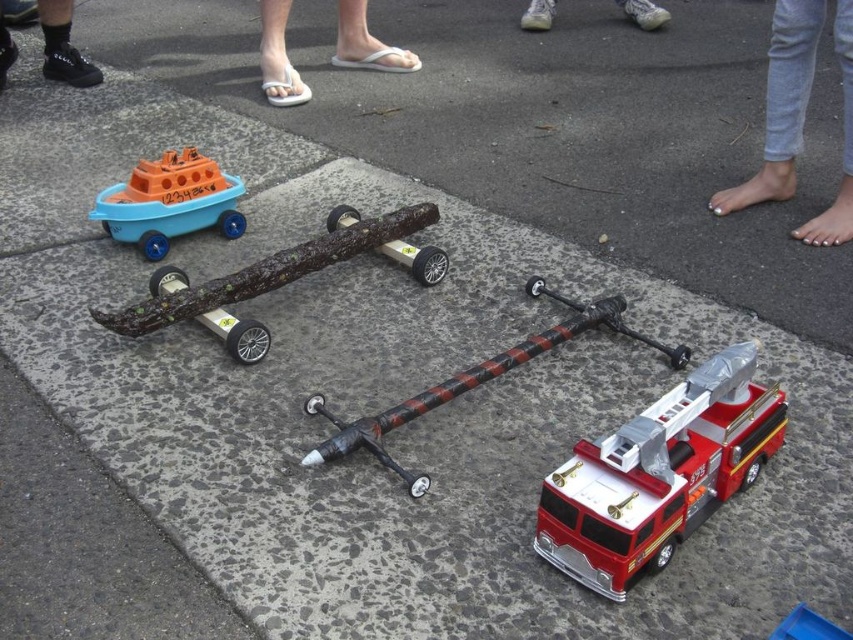
Question: Is matte blue plastic boat at upper left smaller than plastic/toy sword at center?

Choices:
 (A) yes
 (B) no

Answer: (A)

Question: Which is nearer to the gray denim jeans at upper right?

Choices:
 (A) white rubber flip flops at center
 (B) white leather shoe at upper center

Answer: (A)

Question: Considering the real-world distances, which object is closest to the white leather shoe at upper center?

Choices:
 (A) shiny metallic fire truck at lower right
 (B) black leather shoe at upper left
 (C) white rubber flip flops at center
 (D) matte blue plastic boat at upper left

Answer: (C)

Question: Which point appears closest to the camera in this image?

Choices:
 (A) (76, 77)
 (B) (444, 397)
 (C) (801, 227)
 (D) (554, 1)

Answer: (B)

Question: Does shiny metallic fire truck at lower right appear on the right side of wooden log at center?

Choices:
 (A) yes
 (B) no

Answer: (A)

Question: Is matte blue plastic boat at upper left wider than white rubber flip flops at center?

Choices:
 (A) yes
 (B) no

Answer: (A)